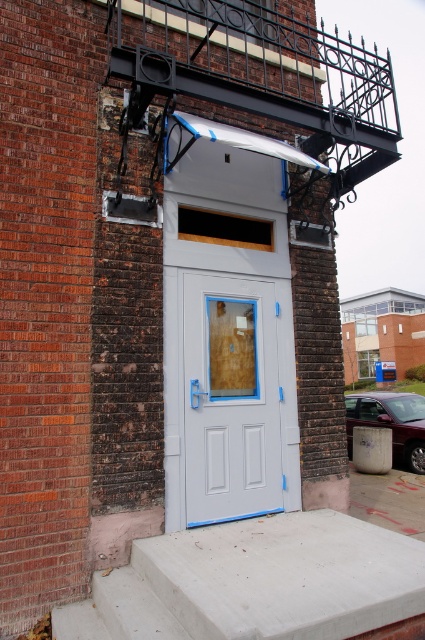
You are a delivery person trying to unload a package from a truck that is parked at the curb. The truck bed is at the same level as the concrete at lower center. Can you directly place the package onto the white painted wood door at center without lifting it higher than the concrete?

The concrete at lower center is shorter than the white painted wood door at center, so you cannot directly place the package onto the white painted wood door at center without lifting it higher since the door is taller than the concrete level.

You are standing in front of the brick building and notice a specific point at coordinates point (255,582). Based on the scene description, what material is located at this point?

The point (255,582) indicates concrete at lower center.